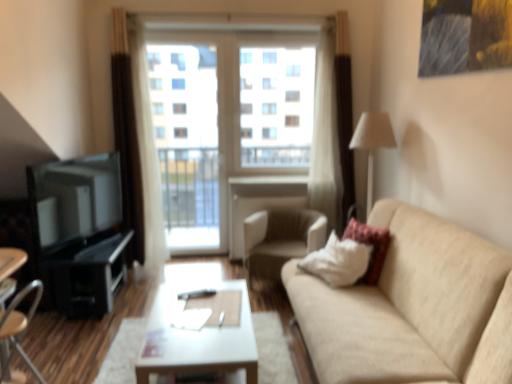
Question: Can you confirm if velvet-like beige pillow at right is positioned to the right of white fabric lampshade at right?

Choices:
 (A) no
 (B) yes

Answer: (A)

Question: Is velvet-like beige pillow at right in contact with white fabric lampshade at right?

Choices:
 (A) no
 (B) yes

Answer: (A)

Question: From the image's perspective, is velvet-like beige pillow at right on white fabric lampshade at right?

Choices:
 (A) no
 (B) yes

Answer: (A)

Question: Considering the relative sizes of velvet-like beige pillow at right and white fabric lampshade at right in the image provided, is velvet-like beige pillow at right shorter than white fabric lampshade at right?

Choices:
 (A) yes
 (B) no

Answer: (A)

Question: From a real-world perspective, is velvet-like beige pillow at right physically below white fabric lampshade at right?

Choices:
 (A) no
 (B) yes

Answer: (B)

Question: Is velvet-like beige pillow at right surrounding white fabric lampshade at right?

Choices:
 (A) yes
 (B) no

Answer: (B)

Question: From the image's perspective, is beige fabric couch at right on top of wooden chair at lower left, which appears as the 1th chair when viewed from the left?

Choices:
 (A) yes
 (B) no

Answer: (A)

Question: Is beige fabric couch at right bigger than wooden chair at lower left, placed as the 2th chair when sorted from right to left?

Choices:
 (A) no
 (B) yes

Answer: (B)

Question: Is wooden chair at lower left, which appears as the 1th chair when viewed from the front, located within beige fabric couch at right?

Choices:
 (A) yes
 (B) no

Answer: (B)

Question: Is beige fabric couch at right facing away from wooden chair at lower left, placed as the 2th chair when sorted from right to left?

Choices:
 (A) no
 (B) yes

Answer: (A)

Question: Considering the relative positions of beige fabric couch at right and wooden chair at lower left, which appears as the 1th chair when viewed from the front, in the image provided, is beige fabric couch at right to the right of wooden chair at lower left, which appears as the 1th chair when viewed from the front, from the viewer's perspective?

Choices:
 (A) no
 (B) yes

Answer: (B)

Question: Does beige fabric couch at right have a greater width compared to wooden chair at lower left, which ranks as the second chair in back-to-front order?

Choices:
 (A) yes
 (B) no

Answer: (A)

Question: Does beige fabric couch at right appear on the left side of velvet-like beige pillow at right?

Choices:
 (A) no
 (B) yes

Answer: (B)